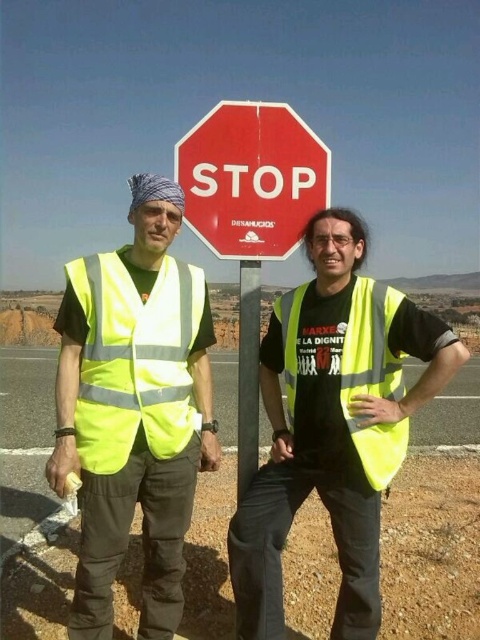
Does point (264, 385) come closer to viewer compared to point (316, 186)?

Yes, point (264, 385) is in front of point (316, 186).

Between yellow reflective vest at center and red matte stop sign at center, which one has less height?

red matte stop sign at center

You are a GUI agent. You are given a task and a screenshot of the screen. Output one action in this format:
    pyautogui.click(x=<x>, y=<y>)
    Task: Click on the yellow reflective vest at center
    The image size is (480, 640).
    Given the screenshot: What is the action you would take?
    pyautogui.click(x=327, y=433)

This screenshot has width=480, height=640. In order to click on yellow reflective vest at center in this screenshot , I will do `click(327, 433)`.

Who is positioned more to the left, red matte stop sign at center or metallic gray pole at center?

metallic gray pole at center is more to the left.

Does red matte stop sign at center come in front of metallic gray pole at center?

Yes, it is.

Is point (207, 170) closer to viewer compared to point (237, 464)?

Yes.

Identify the location of red matte stop sign at center. (252, 179).

Who is taller, yellow reflective vest at center or yellow reflective safety vest at left?

yellow reflective vest at center is taller.

Which is more to the left, yellow reflective vest at center or yellow reflective safety vest at left?

Positioned to the left is yellow reflective safety vest at left.

Is point (336, 225) more distant than point (201, 305)?

No, it is not.

In order to click on yellow reflective vest at center in this screenshot , I will do `click(327, 433)`.